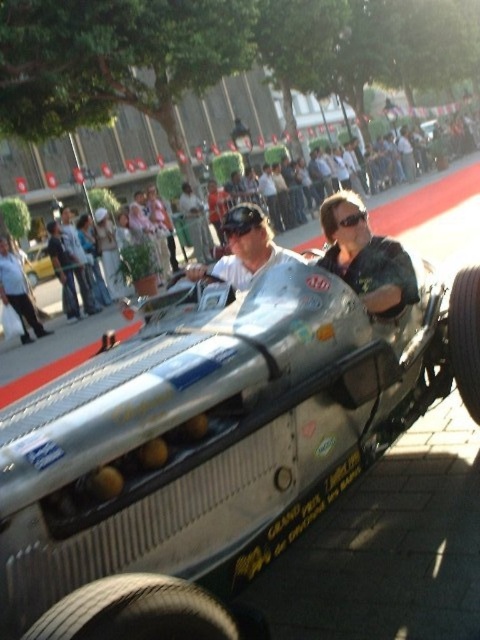
Based on the scene description, where is the white shirt at left in relation to the silver metallic racecar at center?

The white shirt at left is positioned to the right of the silver metallic racecar at center.

You are a photographer at the drag racing event. You want to capture a photo that shows both the matte silver helmet at center and the silver metallic racecar at center. Which object will appear taller in the photo?

The matte silver helmet at center will appear taller in the photo since it is taller than the silver metallic racecar at center according to the description.

In the image of the drag racing car event, there is a white shirt at left and a silver metallic racecar at center. Which object takes up more space in the image?

The silver metallic racecar at center takes up more space in the image than the white shirt at left because the white shirt at left is smaller than the silver metallic racecar at center.